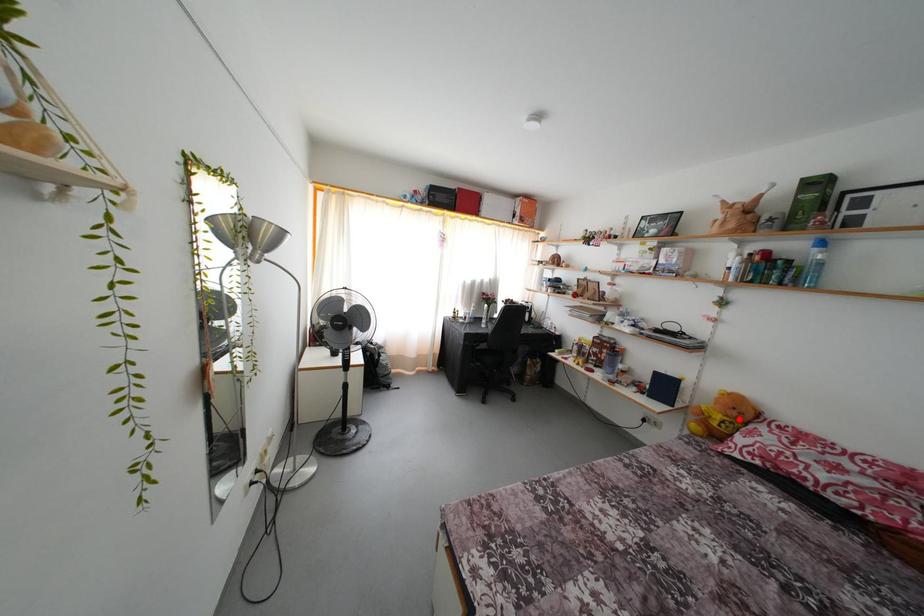
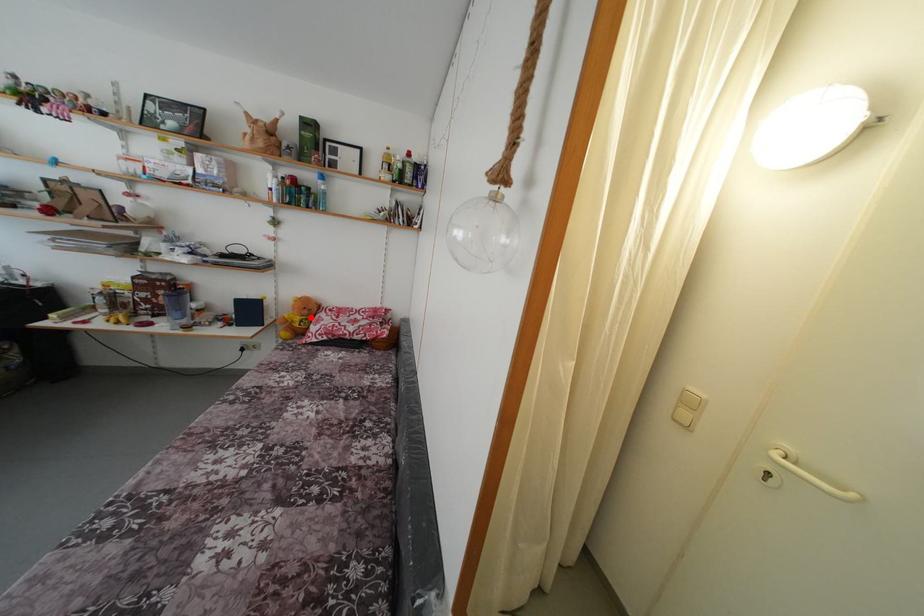
I am providing you with two images of the same scene from different viewpoints. A red point is marked on the first image and another point is marked on the second image. Are the points marked in image1 and image2 representing the same 3D position?

Yes